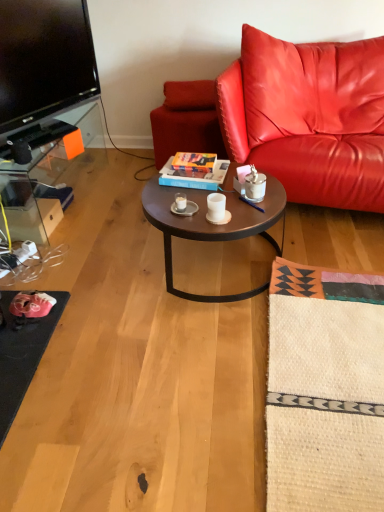
The image size is (384, 512). What do you see at coordinates (216, 207) in the screenshot? I see `white matte cup at center, which is counted as the first coffee cup, starting from the right` at bounding box center [216, 207].

Locate an element on the screen. white matte cup at center, which is counted as the first coffee cup, starting from the right is located at coordinates (216, 207).

Measure the distance between point (181,124) and camera.

A distance of 8.50 feet exists between point (181,124) and camera.

This screenshot has height=512, width=384. Describe the element at coordinates (212, 226) in the screenshot. I see `dark brown wood coffee table at center` at that location.

You are a GUI agent. You are given a task and a screenshot of the screen. Output one action in this format:
    pyautogui.click(x=<x>, y=<y>)
    Task: Click on the leather couch at right
    Image resolution: width=384 pixels, height=512 pixels.
    Given the screenshot: What is the action you would take?
    pyautogui.click(x=294, y=119)

Where is `leather cushion at upper center`? leather cushion at upper center is located at coordinates (189, 95).

Choose the correct answer: Is dark brown wood coffee table at center inside white matte cup at center, which is the second coffee cup in back-to-front order, or outside it?

dark brown wood coffee table at center is outside white matte cup at center, which is the second coffee cup in back-to-front order.

Between dark brown wood coffee table at center and white matte cup at center, arranged as the 1th coffee cup when viewed from the front, which one appears on the left side from the viewer's perspective?

white matte cup at center, arranged as the 1th coffee cup when viewed from the front, is more to the left.

Consider the image. Does dark brown wood coffee table at center come behind white matte cup at center, which is counted as the first coffee cup, starting from the right?

No.

Between dark brown wood coffee table at center and white matte cup at center, which is counted as the first coffee cup, starting from the right, which one has smaller width?

With smaller width is white matte cup at center, which is counted as the first coffee cup, starting from the right.

Based on the photo, is metallic pen at center facing towards dark brown wood coffee table at center?

Yes.

Between metallic pen at center and dark brown wood coffee table at center, which one has larger width?

dark brown wood coffee table at center is wider.

From the image's perspective, between metallic pen at center and dark brown wood coffee table at center, which one is located above?

metallic pen at center is shown above in the image.

In terms of height, does metallic pen at center look taller or shorter compared to dark brown wood coffee table at center?

Clearly, metallic pen at center is shorter compared to dark brown wood coffee table at center.

Could you tell me if dark brown wood coffee table at center is turned towards matte leather swivel chair at center?

No, dark brown wood coffee table at center is not turned towards matte leather swivel chair at center.

From the image's perspective, is dark brown wood coffee table at center located above or below matte leather swivel chair at center?

dark brown wood coffee table at center is situated lower than matte leather swivel chair at center in the image.

Is dark brown wood coffee table at center positioned before matte leather swivel chair at center?

Yes, the depth of dark brown wood coffee table at center is less than that of matte leather swivel chair at center.

From a real-world perspective, between dark brown wood coffee table at center and matte leather swivel chair at center, who is vertically higher?

matte leather swivel chair at center, from a real-world perspective.

From their relative heights in the image, would you say leather cushion at upper center is taller or shorter than leather couch at right?

leather cushion at upper center is shorter than leather couch at right.

Can you tell me how much leather cushion at upper center and leather couch at right differ in facing direction?

21.3 degrees separate the facing orientations of leather cushion at upper center and leather couch at right.

Considering the points (174, 105) and (363, 123), which point is in front, point (174, 105) or point (363, 123)?

Point (363, 123)

At what (x,y) coordinates should I click in order to perform the action: click on pillow lying on the left of leather couch at right. Please return your answer as a coordinate pair (x, y). The width and height of the screenshot is (384, 512). Looking at the image, I should click on (189, 95).

Consider the image. Can you confirm if metallic pen at center is positioned to the left of white matte cup at center, arranged as the 1th coffee cup when viewed from the front?

Incorrect, metallic pen at center is not on the left side of white matte cup at center, arranged as the 1th coffee cup when viewed from the front.

Can you confirm if metallic pen at center is taller than white matte cup at center, which is counted as the first coffee cup, starting from the right?

No.

Considering the points (259, 207) and (216, 210), which point is in front, point (259, 207) or point (216, 210)?

The point (216, 210) is closer to the camera.

From a real-world perspective, is metallic pen at center physically located above or below white matte cup at center, arranged as the 1th coffee cup when viewed from the front?

In terms of real-world spatial position, metallic pen at center is below white matte cup at center, arranged as the 1th coffee cup when viewed from the front.

From the image's perspective, which one is positioned higher, metallic pen at center or leather cushion at upper center?

leather cushion at upper center, from the image's perspective.

Is leather cushion at upper center at the back of metallic pen at center?

That's right, metallic pen at center is facing away from leather cushion at upper center.

Considering the sizes of objects metallic pen at center and leather cushion at upper center in the image provided, who is shorter, metallic pen at center or leather cushion at upper center?

With less height is metallic pen at center.

Is metallic pen at center thinner than leather cushion at upper center?

Yes, metallic pen at center is thinner than leather cushion at upper center.

From a real-world perspective, which is physically above, white matte cup at center, which ranks as the 2th coffee cup in left-to-right order, or metallic pen at center?

white matte cup at center, which ranks as the 2th coffee cup in left-to-right order, is physically above.

Considering the relative positions of white matte cup at center, which is counted as the first coffee cup, starting from the right, and metallic pen at center in the image provided, is white matte cup at center, which is counted as the first coffee cup, starting from the right, in front of metallic pen at center?

Yes, white matte cup at center, which is counted as the first coffee cup, starting from the right, is closer to the viewer.

Based on the photo, is metallic pen at center surrounded by white matte cup at center, arranged as the 1th coffee cup when viewed from the front?

No, metallic pen at center is located outside of white matte cup at center, arranged as the 1th coffee cup when viewed from the front.

Is the surface of white matte cup at center, which is counted as the first coffee cup, starting from the right, in direct contact with metallic pen at center?

No, white matte cup at center, which is counted as the first coffee cup, starting from the right, is not next to metallic pen at center.

Where is `coffee table below the white matte cup at center, which ranks as the 2th coffee cup in left-to-right order (from the image's perspective)`? This screenshot has width=384, height=512. coffee table below the white matte cup at center, which ranks as the 2th coffee cup in left-to-right order (from the image's perspective) is located at coordinates (212, 226).

Find the location of a particular element. coffee table on the left side of metallic pen at center is located at coordinates (212, 226).

Estimate the real-world distances between objects in this image. Which object is closer to leather couch at right, clear glass tv stand at left or leather cushion at upper center?

Among the two, leather cushion at upper center is located nearer to leather couch at right.

From the image, which object appears to be farther from dark brown wood coffee table at center, metallic pen at center or leather couch at right?

leather couch at right is further to dark brown wood coffee table at center.

Based on their spatial positions, is metallic pen at center or white ceramic mug at center, which ranks as the 1th coffee cup in left-to-right order, closer to white matte cup at center, arranged as the 1th coffee cup when viewed from the front?

white ceramic mug at center, which ranks as the 1th coffee cup in left-to-right order, is positioned closer to the anchor white matte cup at center, arranged as the 1th coffee cup when viewed from the front.

When comparing their distances from metallic pen at center, does white ceramic mug at center, which is the 1th coffee cup in back-to-front order, or leather cushion at upper center seem further?

leather cushion at upper center is positioned further to the anchor metallic pen at center.

Considering their positions, is matte leather swivel chair at center positioned further to leather couch at right than white matte cup at center, which is the second coffee cup in back-to-front order?

The object further to leather couch at right is white matte cup at center, which is the second coffee cup in back-to-front order.

From the image, which object appears to be farther from white ceramic mug at center, which appears as the 2th coffee cup when viewed from the right, leather couch at right or dark brown wood coffee table at center?

The object further to white ceramic mug at center, which appears as the 2th coffee cup when viewed from the right, is leather couch at right.

Estimate the real-world distances between objects in this image. Which object is closer to white matte cup at center, which ranks as the 2th coffee cup in left-to-right order, clear glass tv stand at left or leather couch at right?

leather couch at right lies closer to white matte cup at center, which ranks as the 2th coffee cup in left-to-right order, than the other object.

Estimate the real-world distances between objects in this image. Which object is closer to white ceramic mug at center, the 2th coffee cup from the front, clear glass tv stand at left or leather cushion at upper center?

leather cushion at upper center lies closer to white ceramic mug at center, the 2th coffee cup from the front, than the other object.

Find the location of a particular element. swivel chair situated between clear glass tv stand at left and metallic pen at center from left to right is located at coordinates pyautogui.click(x=186, y=121).

At what (x,y) coordinates should I click in order to perform the action: click on coffee table between white ceramic mug at center, which is the 1th coffee cup in back-to-front order, and metallic pen at center, in the horizontal direction. Please return your answer as a coordinate pair (x, y). Image resolution: width=384 pixels, height=512 pixels. Looking at the image, I should click on (212, 226).

Image resolution: width=384 pixels, height=512 pixels. In order to click on pillow between clear glass tv stand at left and matte leather swivel chair at center in this screenshot , I will do `click(189, 95)`.

I want to click on pen between leather couch at right and matte leather swivel chair at center along the z-axis, so click(251, 204).